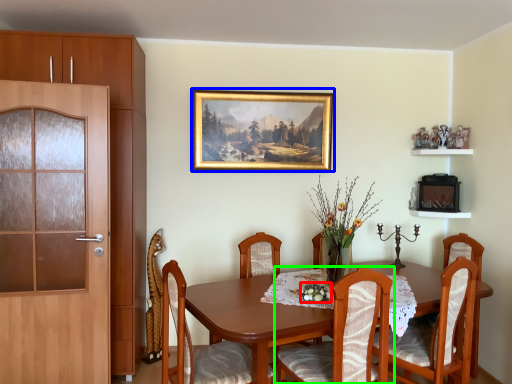
Question: Which object is the closest to the floral arrangement (highlighted by a red box)? Choose among these: picture frame (highlighted by a blue box) or chair (highlighted by a green box).

Choices:
 (A) picture frame
 (B) chair

Answer: (B)